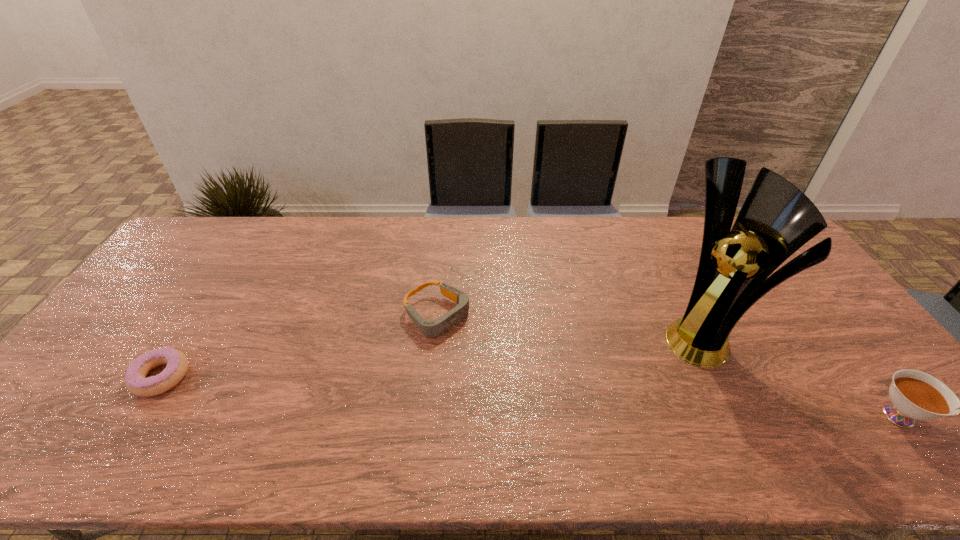
Locate an element on the screen. The width and height of the screenshot is (960, 540). free region located on the front and back of the goggles is located at coordinates (497, 360).

The width and height of the screenshot is (960, 540). What are the coordinates of `free location located on the front and back of the goggles` in the screenshot? It's located at (561, 410).

Locate an element on the screen. The height and width of the screenshot is (540, 960). vacant space located 0.270m on the front and back of the goggles is located at coordinates (535, 389).

Where is `doughnut that is at the near edge`? Image resolution: width=960 pixels, height=540 pixels. doughnut that is at the near edge is located at coordinates (136, 382).

Find the location of a particular element. The height and width of the screenshot is (540, 960). teacup at the near edge is located at coordinates (916, 395).

What are the coordinates of `object that is at the right edge` in the screenshot? It's located at (916, 395).

What are the coordinates of `object situated at the near right corner` in the screenshot? It's located at (916, 395).

This screenshot has height=540, width=960. Find the location of `vacant region at the far edge`. vacant region at the far edge is located at coordinates (536, 232).

In the image, there is a desktop. Where is `vacant space at the near edge`? Image resolution: width=960 pixels, height=540 pixels. vacant space at the near edge is located at coordinates (760, 393).

Identify the location of vacant space at the left edge of the desktop. The image size is (960, 540). (84, 388).